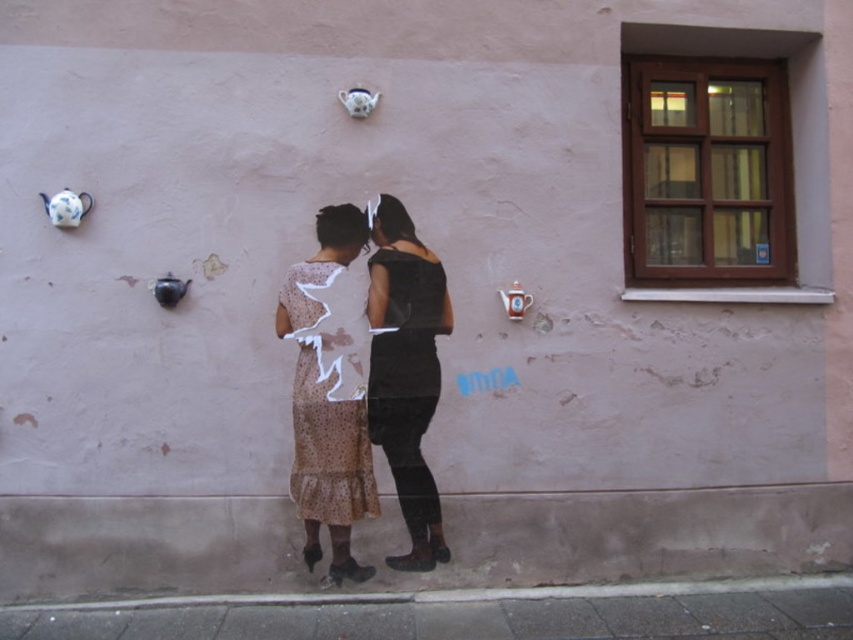
You are standing in front of the wall with the teapots and need to reach both points. Which point, point (383, 364) or point (305, 324), is closer to you?

Point (383, 364) is closer to you because it is further to the viewer than point (305, 324).

You are a fashion designer observing two dresses displayed against a wall with teapots. The dresses are the matte white dress at center and the black matte dress at center. Which dress is wider?

The matte white dress at center is wider than the black matte dress at center according to the description.

You are a fashion designer observing two dresses displayed against a wall with teapots. The dresses are the matte white dress at center and the black matte dress at center. Which dress is taller?

Result: The matte white dress at center is taller than the black matte dress at center.